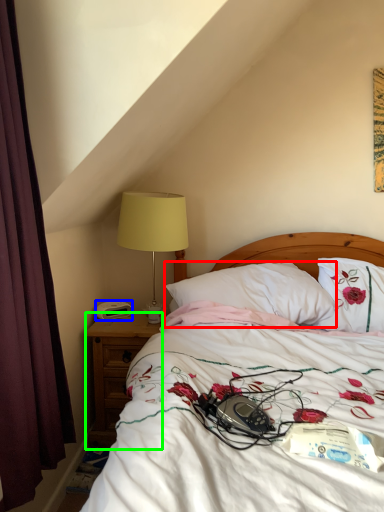
Question: Which is farther away from pillow (highlighted by a red box)? alarm clock (highlighted by a blue box) or nightstand (highlighted by a green box)?

Choices:
 (A) alarm clock
 (B) nightstand

Answer: (A)